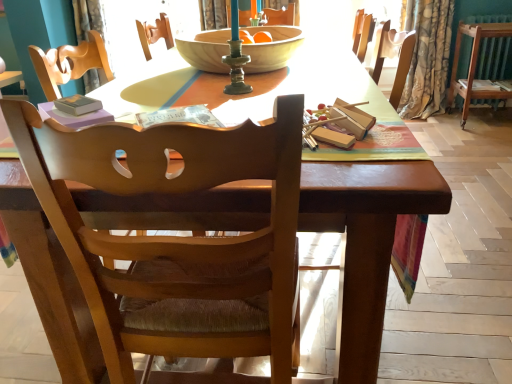
Question: In terms of width, does wooden bowl at center look wider or thinner when compared to wooden chair at center?

Choices:
 (A) thin
 (B) wide

Answer: (B)

Question: Is wooden bowl at center in front of or behind wooden chair at center in the image?

Choices:
 (A) front
 (B) behind

Answer: (B)

Question: Which object is the farthest from the green metallic candle holder at center?

Choices:
 (A) hardcover book at upper left, the 2th paperback book in the back-to-front sequence
 (B) matte purple paperback book at right, the 2th paperback book in the bottom-to-top sequence
 (C) light beige fabric curtain at upper left, which ranks as the 1th curtain in left-to-right order
 (D) wooden chair at center
 (E) floral fabric curtain at right, positioned as the 1th curtain in right-to-left order

Answer: (B)

Question: Based on their relative distances, which object is farther from the hardcover book at upper left, arranged as the 1th paperback book when viewed from the left?

Choices:
 (A) light beige fabric curtain at upper left, which ranks as the 1th curtain in left-to-right order
 (B) wooden bowl at center
 (C) floral fabric curtain at right, positioned as the 1th curtain in right-to-left order
 (D) wooden chair at center
 (E) matte purple paperback book at right, which is the 2th paperback book in front-to-back order

Answer: (E)